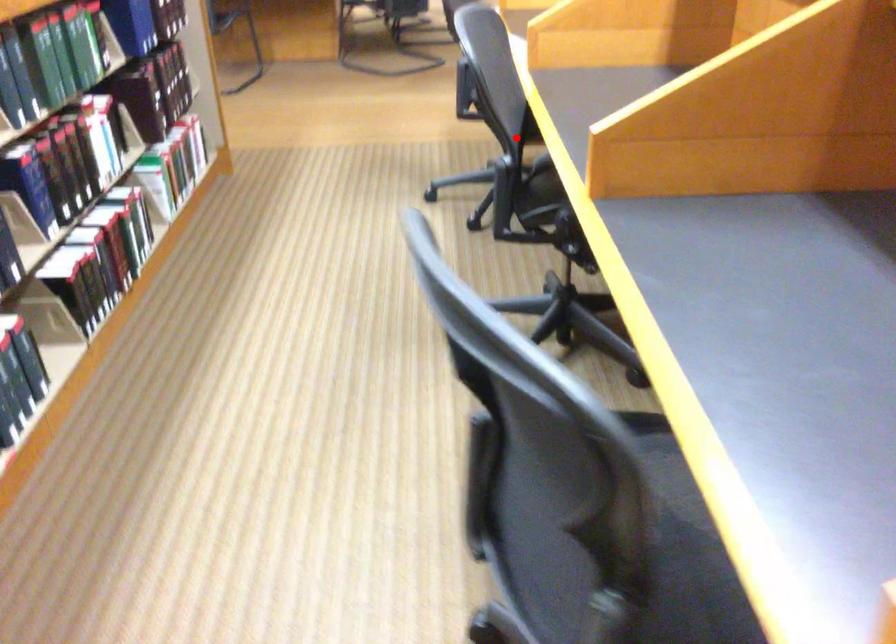
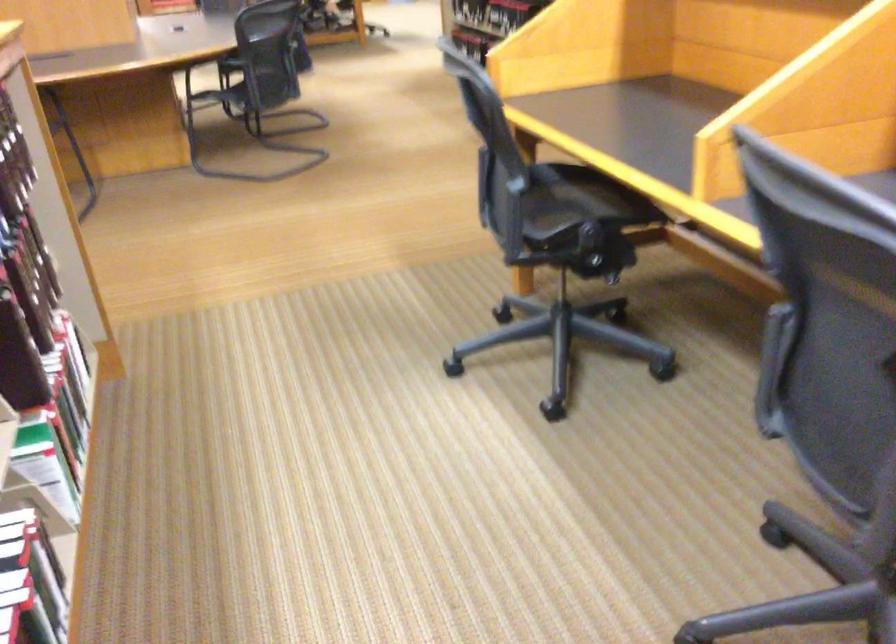
Question: I am providing you with two images of the same scene from different viewpoints. Given a red point in image1, look at the same physical point in image2. Is it:

Choices:
 (A) Closer to the viewpoint
 (B) Farther from the viewpoint

Answer: (A)